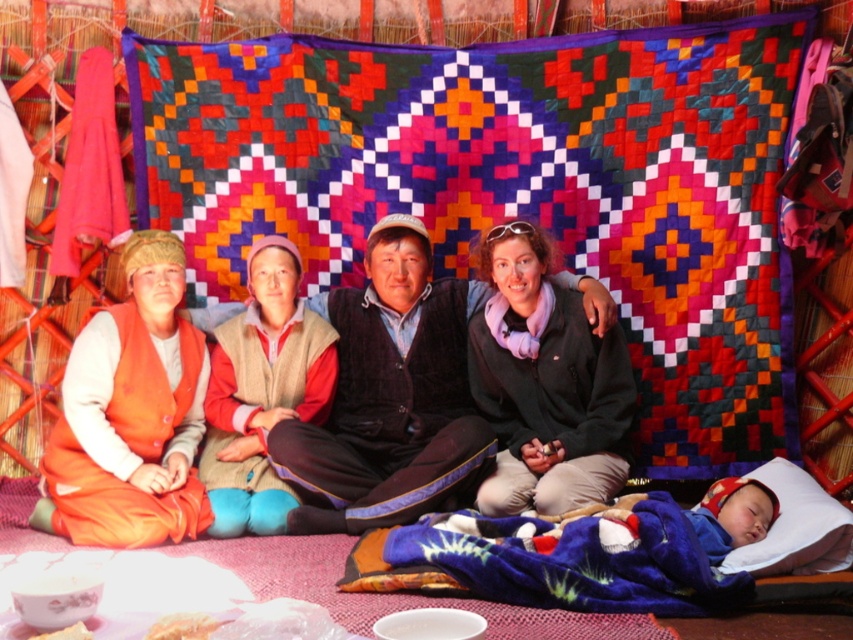
Measure the distance from velvet-like sweater at center to orange suede vest at left.

velvet-like sweater at center and orange suede vest at left are 59.64 centimeters apart.

Is point (467, 449) positioned in front of point (167, 266)?

Yes, it is in front of point (167, 266).

Where is `velvet-like sweater at center`? velvet-like sweater at center is located at coordinates (390, 396).

Is point (463, 310) positioned in front of point (485, 339)?

No.

Who is shorter, velvet-like sweater at center or black fleece jacket at center?

black fleece jacket at center

The width and height of the screenshot is (853, 640). I want to click on velvet-like sweater at center, so click(390, 396).

Identify the location of velvet-like sweater at center. (390, 396).

Does orange suede vest at left come in front of black fleece jacket at center?

Yes, it is in front of black fleece jacket at center.

What do you see at coordinates (131, 416) in the screenshot? I see `orange suede vest at left` at bounding box center [131, 416].

Is point (148, 445) positioned behind point (502, 476)?

Yes, point (148, 445) is behind point (502, 476).

At what (x,y) coordinates should I click in order to perform the action: click on orange suede vest at left. Please return your answer as a coordinate pair (x, y). The height and width of the screenshot is (640, 853). Looking at the image, I should click on (131, 416).